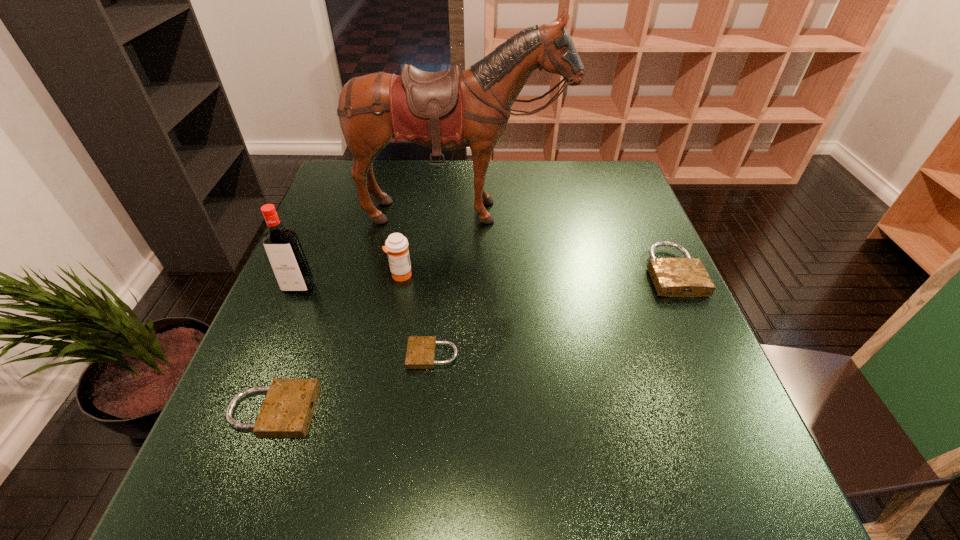
Locate an element on the screen. Image resolution: width=960 pixels, height=540 pixels. padlock that is at the left edge is located at coordinates (288, 407).

At what (x,y) coordinates should I click in order to perform the action: click on saddle at the left edge. Please return your answer as a coordinate pair (x, y). This screenshot has height=540, width=960. Looking at the image, I should click on (448, 110).

This screenshot has height=540, width=960. I want to click on vodka positioned at the left edge, so click(x=287, y=259).

Image resolution: width=960 pixels, height=540 pixels. In order to click on object that is at the right edge in this screenshot , I will do `click(673, 277)`.

The width and height of the screenshot is (960, 540). What are the coordinates of `object positioned at the far left corner` in the screenshot? It's located at (448, 110).

Identify the location of object that is positioned at the near left corner. The width and height of the screenshot is (960, 540). (288, 407).

Find the location of a particular element. This screenshot has height=540, width=960. vacant space at the far edge of the desktop is located at coordinates (516, 163).

Where is `free space at the near edge`? The height and width of the screenshot is (540, 960). free space at the near edge is located at coordinates (391, 442).

Locate an element on the screen. Image resolution: width=960 pixels, height=540 pixels. vacant region at the left edge of the desktop is located at coordinates (259, 366).

You are a GUI agent. You are given a task and a screenshot of the screen. Output one action in this format:
    pyautogui.click(x=<x>, y=<y>)
    Task: Click on the free spot at the right edge of the desktop
    This screenshot has width=960, height=540.
    Given the screenshot: What is the action you would take?
    point(629,240)